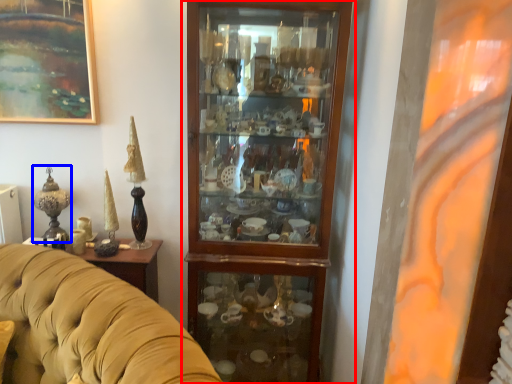
Question: Which object is further to the camera taking this photo, cupboard (highlighted by a red box) or candle holder (highlighted by a blue box)?

Choices:
 (A) cupboard
 (B) candle holder

Answer: (B)